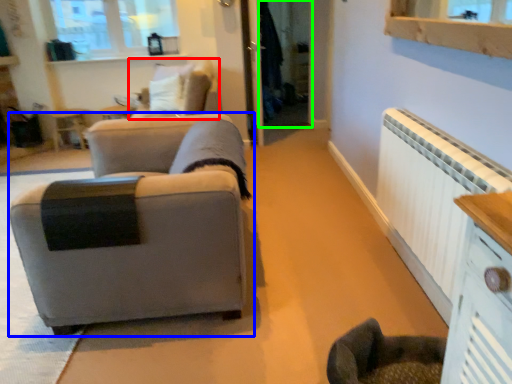
Question: Based on their relative distances, which object is farther from swivel chair (highlighted by a red box)? Choose from studio couch (highlighted by a blue box) and glass door (highlighted by a green box).

Choices:
 (A) studio couch
 (B) glass door

Answer: (A)